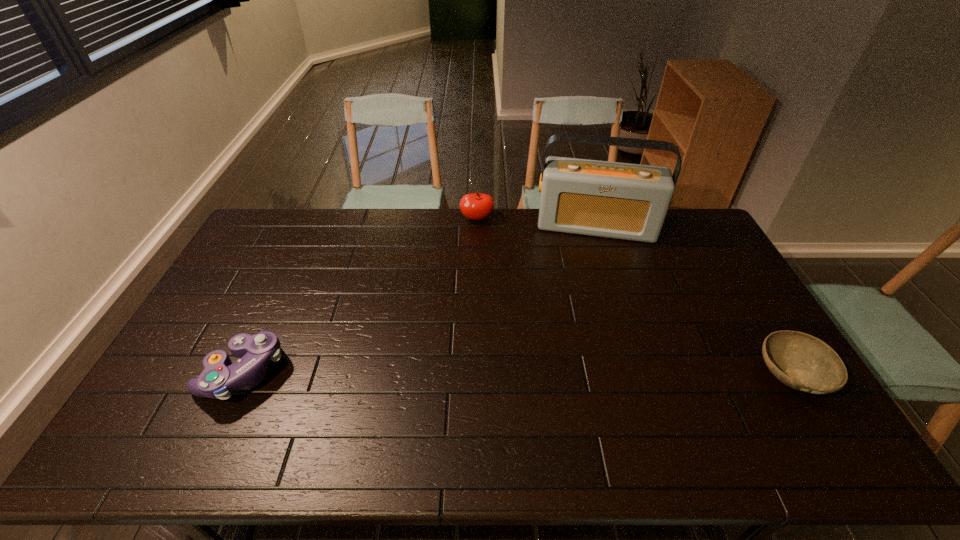
I want to click on control, so click(220, 377).

Identify the location of the leftmost object. This screenshot has height=540, width=960. (220, 377).

What are the coordinates of `the shortest object` in the screenshot? It's located at (x=803, y=362).

Locate an element on the screen. This screenshot has width=960, height=540. the rightmost object is located at coordinates (803, 362).

Locate an element on the screen. apple is located at coordinates (476, 206).

At what (x,y) coordinates should I click in order to perform the action: click on the third shortest object. Please return your answer as a coordinate pair (x, y). Looking at the image, I should click on (476, 206).

Identify the location of radio receiver. This screenshot has height=540, width=960. (626, 201).

Locate an element on the screen. the tallest object is located at coordinates (626, 201).

You are a GUI agent. You are given a task and a screenshot of the screen. Output one action in this format:
    pyautogui.click(x=<x>, y=<y>)
    Task: Click on the free region located 0.190m on the back of the control
    
    Given the screenshot: What is the action you would take?
    pyautogui.click(x=280, y=291)

You are a GUI agent. You are given a task and a screenshot of the screen. Output one action in this format:
    pyautogui.click(x=<x>, y=<y>)
    Task: Click on the free space located 0.210m on the left of the rightmost object
    
    Given the screenshot: What is the action you would take?
    pyautogui.click(x=679, y=375)